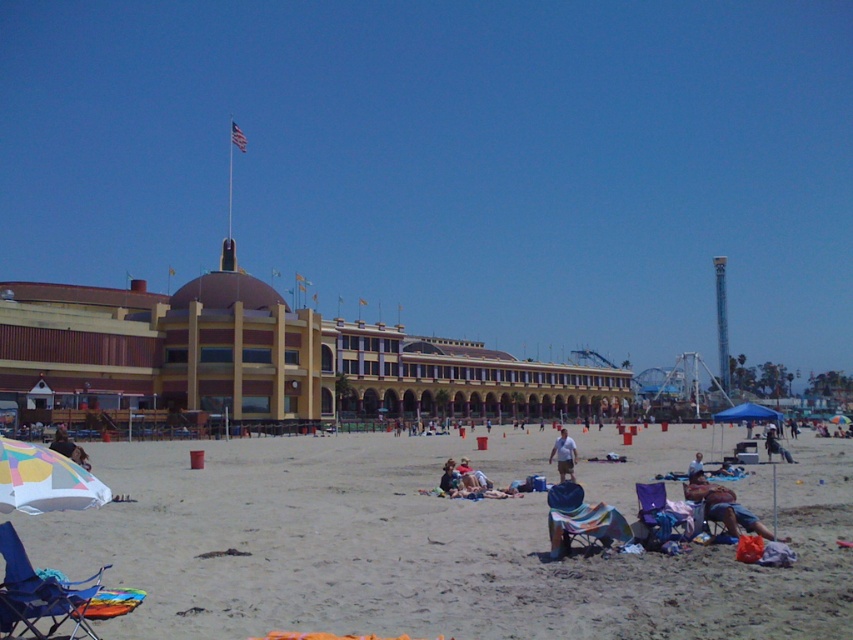
Consider the image. Who is more forward, (431, 624) or (689, 474)?

Point (431, 624) is in front.

Who is taller, beige sand beach at center or light blue fabric umbrella at center?

With more height is beige sand beach at center.

What do you see at coordinates (422, 547) in the screenshot? The image size is (853, 640). I see `beige sand beach at center` at bounding box center [422, 547].

The image size is (853, 640). I want to click on beige sand beach at center, so click(x=422, y=547).

Does multicolored fabric umbrella at lower left lie in front of light blue cotton shirt at center?

Yes, multicolored fabric umbrella at lower left is closer to the viewer.

Between point (94, 484) and point (572, 449), which one is positioned behind?

The point (572, 449) is more distant.

Which is in front, point (54, 467) or point (567, 460)?

Point (54, 467) is in front.

Locate an element on the screen. This screenshot has height=640, width=853. multicolored fabric umbrella at lower left is located at coordinates (44, 481).

How far apart are beige sand beach at center and multicolored fabric umbrella at center?

The distance of beige sand beach at center from multicolored fabric umbrella at center is 72.82 meters.

Between beige sand beach at center and multicolored fabric umbrella at center, which one has more height?

beige sand beach at center is taller.

In order to click on beige sand beach at center in this screenshot , I will do `click(422, 547)`.